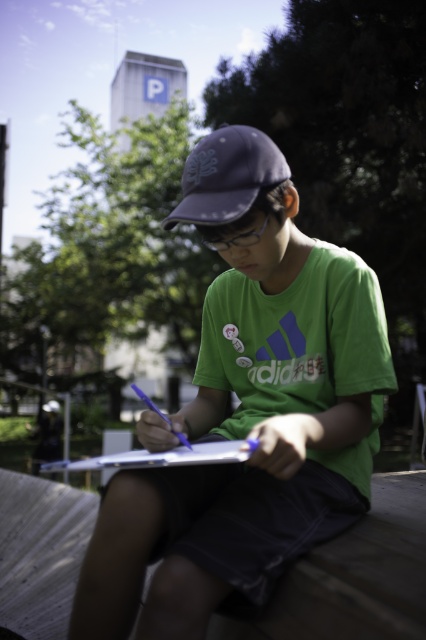
Question: Does matte blue baseball cap at center have a greater width compared to white paper at center?

Choices:
 (A) no
 (B) yes

Answer: (A)

Question: Is matte blue baseball cap at center bigger than white paper at center?

Choices:
 (A) no
 (B) yes

Answer: (A)

Question: Among these points, which one is farthest from the camera?

Choices:
 (A) (155, 584)
 (B) (172, 456)

Answer: (B)

Question: Which point is closer to the camera?

Choices:
 (A) (187, 186)
 (B) (336, 358)
 (C) (238, 444)

Answer: (C)

Question: Which point is farther to the camera?

Choices:
 (A) green matte shirt at center
 (B) white paper at center
 (C) matte blue baseball cap at center

Answer: (C)

Question: Considering the relative positions of green matte shirt at center and matte blue baseball cap at center in the image provided, where is green matte shirt at center located with respect to matte blue baseball cap at center?

Choices:
 (A) below
 (B) above

Answer: (A)